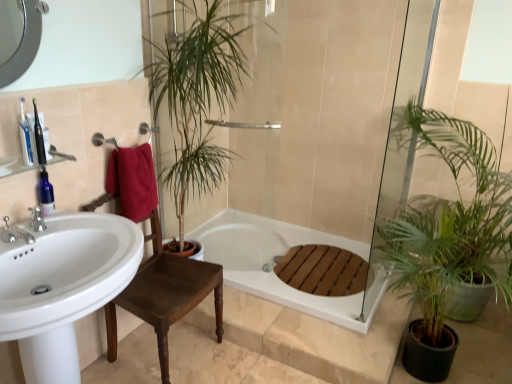
This screenshot has width=512, height=384. What do you see at coordinates (133, 181) in the screenshot?
I see `red cotton towel at upper left` at bounding box center [133, 181].

What is the approximate height of green leafy plant at right, which is counted as the 2th houseplant, starting from the left?

green leafy plant at right, which is counted as the 2th houseplant, starting from the left, is 1.37 meters in height.

Describe the element at coordinates (448, 236) in the screenshot. This screenshot has height=384, width=512. I see `green leafy plant at right, which is the 1th houseplant from right to left` at that location.

Identify the location of black plastic toothbrush at left, placed as the second toiletry when sorted from front to back. (39, 137).

Measure the distance between point (25,152) and camera.

Point (25,152) is 1.53 meters away from camera.

Describe the element at coordinates (274, 263) in the screenshot. I see `white matte bathtub at center` at that location.

At what (x,y) coordinates should I click in order to perform the action: click on white matte bathtub at center. Please return your answer as a coordinate pair (x, y). Looking at the image, I should click on (274, 263).

This screenshot has height=384, width=512. In order to click on brushed metal faucet at left, which is the second tap in back-to-front order in this screenshot , I will do `click(15, 233)`.

In order to face brushed metal faucet at left, which is the second tap in back-to-front order, should I rotate leftwards or rightwards?

It's best to rotate left around 28.733 degrees.

The height and width of the screenshot is (384, 512). I want to click on red cotton towel at upper left, so click(x=133, y=181).

From their relative heights in the image, would you say brown wooden chair at center is taller or shorter than white matte bathtub at center?

In the image, brown wooden chair at center appears to be taller than white matte bathtub at center.

Between brown wooden chair at center and white matte bathtub at center, which one appears on the left side from the viewer's perspective?

brown wooden chair at center.

Considering the points (155, 217) and (243, 246), which point is in front, point (155, 217) or point (243, 246)?

The point (155, 217) is closer.

From a real-world perspective, between brown wooden chair at center and white matte bathtub at center, who is vertically higher?

brown wooden chair at center is physically above.

Is translucent plastic toothbrush at upper left, the third toiletry positioned from the back, a part of white matte bathtub at center?

No, translucent plastic toothbrush at upper left, the third toiletry positioned from the back, is not a part of white matte bathtub at center.

Who is taller, white matte bathtub at center or translucent plastic toothbrush at upper left, the third toiletry positioned from the back?

translucent plastic toothbrush at upper left, the third toiletry positioned from the back.

Considering the relative sizes of white matte bathtub at center and translucent plastic toothbrush at upper left, the third toiletry positioned from the back, in the image provided, is white matte bathtub at center thinner than translucent plastic toothbrush at upper left, the third toiletry positioned from the back,?

In fact, white matte bathtub at center might be wider than translucent plastic toothbrush at upper left, the third toiletry positioned from the back.

Based on the photo, is white matte bathtub at center positioned with its back to translucent plastic toothbrush at upper left, the 1th toiletry in the front-to-back sequence?

white matte bathtub at center is not turned away from translucent plastic toothbrush at upper left, the 1th toiletry in the front-to-back sequence.

Considering the positions of points (39, 152) and (48, 187), is point (39, 152) farther from camera compared to point (48, 187)?

No, it is in front of (48, 187).

Which object is positioned more to the right, black plastic toothbrush at left, the 2th toiletry when ordered from back to front, or translucent blue bottle at left, acting as the 1th toiletry starting from the back?

black plastic toothbrush at left, the 2th toiletry when ordered from back to front, is more to the right.

Is black plastic toothbrush at left, the 2th toiletry when ordered from back to front, beside translucent blue bottle at left, acting as the 1th toiletry starting from the back?

black plastic toothbrush at left, the 2th toiletry when ordered from back to front, and translucent blue bottle at left, acting as the 1th toiletry starting from the back, are not in contact.

Considering the relative sizes of black plastic toothbrush at left, the 2th toiletry when ordered from back to front, and translucent blue bottle at left, the third toiletry positioned from the front, in the image provided, is black plastic toothbrush at left, the 2th toiletry when ordered from back to front, wider than translucent blue bottle at left, the third toiletry positioned from the front,?

No, black plastic toothbrush at left, the 2th toiletry when ordered from back to front, is not wider than translucent blue bottle at left, the third toiletry positioned from the front.

Does point (27, 162) appear closer or farther from the camera than point (211, 274)?

Point (27, 162) appears to be closer to the viewer than point (211, 274).

From the image's perspective, which one is positioned higher, translucent plastic toothbrush at upper left, the third toiletry positioned from the back, or brown wooden chair at center?

translucent plastic toothbrush at upper left, the third toiletry positioned from the back, appears higher in the image.

Is translucent plastic toothbrush at upper left, the 1th toiletry in the front-to-back sequence, not close to brown wooden chair at center?

No.

Between translucent plastic toothbrush at upper left, the 1th toiletry in the front-to-back sequence, and brown wooden chair at center, which one is positioned in front?

translucent plastic toothbrush at upper left, the 1th toiletry in the front-to-back sequence, is in front.

Consider the image. Which is nearer, (53,213) or (128,215)?

Clearly, point (53,213) is closer to the camera than point (128,215).

From a real-world perspective, is translucent blue bottle at left, acting as the 1th toiletry starting from the back, located beneath red cotton towel at upper left?

No, from a real-world perspective, translucent blue bottle at left, acting as the 1th toiletry starting from the back, is not beneath red cotton towel at upper left.

Which of these two, translucent blue bottle at left, acting as the 1th toiletry starting from the back, or red cotton towel at upper left, stands taller?

With more height is red cotton towel at upper left.

Identify the location of bath towel below the translucent blue bottle at left, the third toiletry positioned from the front (from a real-world perspective). (133, 181).

Is point (152, 43) farther from camera compared to point (405, 264)?

Yes, point (152, 43) is behind point (405, 264).

Considering the sizes of objects green leafy plant at center, which ranks as the 2th houseplant in right-to-left order, and green leafy plant at right, which is the 1th houseplant from right to left, in the image provided, who is wider, green leafy plant at center, which ranks as the 2th houseplant in right-to-left order, or green leafy plant at right, which is the 1th houseplant from right to left,?

green leafy plant at right, which is the 1th houseplant from right to left, is wider.

From a real-world perspective, is green leafy plant at center, which ranks as the 2th houseplant in right-to-left order, positioned over green leafy plant at right, which is counted as the 2th houseplant, starting from the left, based on gravity?

Yes, from a real-world perspective, green leafy plant at center, which ranks as the 2th houseplant in right-to-left order, is on top of green leafy plant at right, which is counted as the 2th houseplant, starting from the left.

Is green leafy plant at right, which is the 1th houseplant from right to left, positioned far away from translucent blue bottle at left, acting as the 1th toiletry starting from the back?

Indeed, green leafy plant at right, which is the 1th houseplant from right to left, is not near translucent blue bottle at left, acting as the 1th toiletry starting from the back.

From the image's perspective, is green leafy plant at right, which is the 1th houseplant from right to left, below translucent blue bottle at left, the third toiletry positioned from the front?

Yes, from the image's perspective, green leafy plant at right, which is the 1th houseplant from right to left, is beneath translucent blue bottle at left, the third toiletry positioned from the front.

Is translucent blue bottle at left, the third toiletry positioned from the front, located within green leafy plant at right, which is counted as the 2th houseplant, starting from the left?

Actually, translucent blue bottle at left, the third toiletry positioned from the front, is outside green leafy plant at right, which is counted as the 2th houseplant, starting from the left.

Locate an element on the screen. The width and height of the screenshot is (512, 384). bathtub below the brown wooden chair at center (from a real-world perspective) is located at coordinates (274, 263).

Where is `toiletry that is the 3rd one when counting forward from the white matte bathtub at center`? toiletry that is the 3rd one when counting forward from the white matte bathtub at center is located at coordinates (25, 137).

When comparing their distances from translucent plastic toothbrush at upper left, the 1th toiletry in the front-to-back sequence, does silver metallic faucet at left, the second tap viewed from the front, or green leafy plant at right, which is counted as the 2th houseplant, starting from the left, seem further?

green leafy plant at right, which is counted as the 2th houseplant, starting from the left.

Considering their positions, is red cotton towel at upper left positioned further to blue glass toothbrush at upper left than translucent blue bottle at left, acting as the 1th toiletry starting from the back?

Based on the image, red cotton towel at upper left appears to be further to blue glass toothbrush at upper left.

From the image, which object appears to be farther from translucent plastic toothbrush at upper left, the third toiletry positioned from the back, brown wooden chair at center or green leafy plant at right, which is counted as the 2th houseplant, starting from the left?

green leafy plant at right, which is counted as the 2th houseplant, starting from the left, is further to translucent plastic toothbrush at upper left, the third toiletry positioned from the back.

When comparing their distances from green leafy plant at right, which is counted as the 2th houseplant, starting from the left, does brown wooden chair at center or red cotton towel at upper left seem further?

red cotton towel at upper left lies further to green leafy plant at right, which is counted as the 2th houseplant, starting from the left, than the other object.

From the image, which object appears to be farther from blue glass toothbrush at upper left, brown wooden chair at center or green leafy plant at center, which appears as the 1th houseplant when viewed from the left?

green leafy plant at center, which appears as the 1th houseplant when viewed from the left, is positioned further to the anchor blue glass toothbrush at upper left.

From the image, which object appears to be farther from white matte bathtub at center, silver metallic faucet at left, acting as the first tap starting from the back, or green leafy plant at right, which is counted as the 2th houseplant, starting from the left?

The object further to white matte bathtub at center is silver metallic faucet at left, acting as the first tap starting from the back.

Estimate the real-world distances between objects in this image. Which object is closer to silver metallic faucet at left, the second tap viewed from the front, green leafy plant at right, which is counted as the 2th houseplant, starting from the left, or white matte bathtub at center?

white matte bathtub at center lies closer to silver metallic faucet at left, the second tap viewed from the front, than the other object.

Consider the image. Estimate the real-world distances between objects in this image. Which object is closer to red cotton towel at upper left, brown wooden chair at center or white matte bathtub at center?

brown wooden chair at center is closer to red cotton towel at upper left.

Identify the location of toiletry between translucent plastic toothbrush at upper left, the third toiletry positioned from the back, and green leafy plant at right, which is counted as the 2th houseplant, starting from the left, from left to right. The image size is (512, 384). (39, 137).

Locate an element on the screen. chair between white glossy sink at left and white matte bathtub at center from front to back is located at coordinates (x=165, y=295).

The image size is (512, 384). I want to click on chair between black plastic toothbrush at left, placed as the second toiletry when sorted from front to back, and green leafy plant at right, which is the 1th houseplant from right to left, in the horizontal direction, so click(165, 295).

Where is `bath towel between black plastic toothbrush at left, the 2th toiletry when ordered from back to front, and white matte bathtub at center, in the horizontal direction`? Image resolution: width=512 pixels, height=384 pixels. bath towel between black plastic toothbrush at left, the 2th toiletry when ordered from back to front, and white matte bathtub at center, in the horizontal direction is located at coordinates (133, 181).